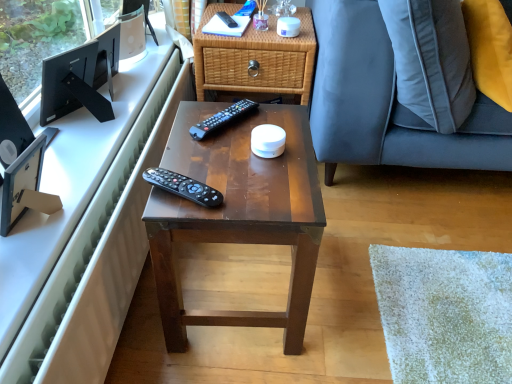
Where is `unoccupied area in front of black matte monitor at upper left, marked as the first television in a back-to-front arrangement`? This screenshot has width=512, height=384. unoccupied area in front of black matte monitor at upper left, marked as the first television in a back-to-front arrangement is located at coordinates (77, 155).